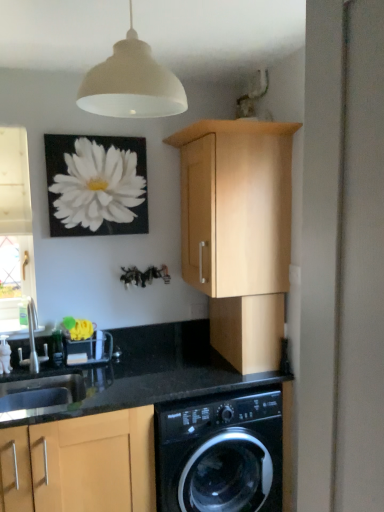
This screenshot has height=512, width=384. What are the coordinates of `free space above black glossy washing machine at lower center (from a real-world perspective)` in the screenshot? It's located at (204, 366).